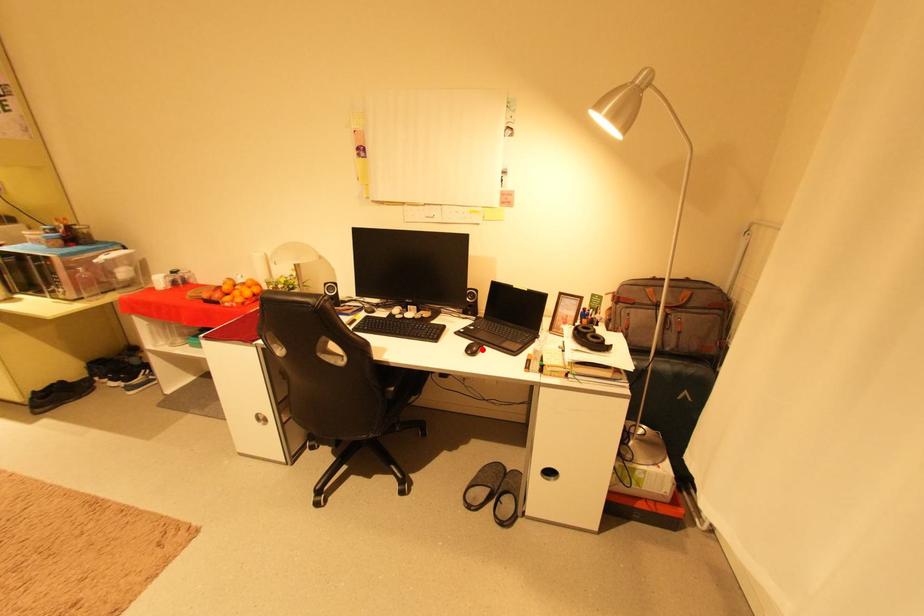
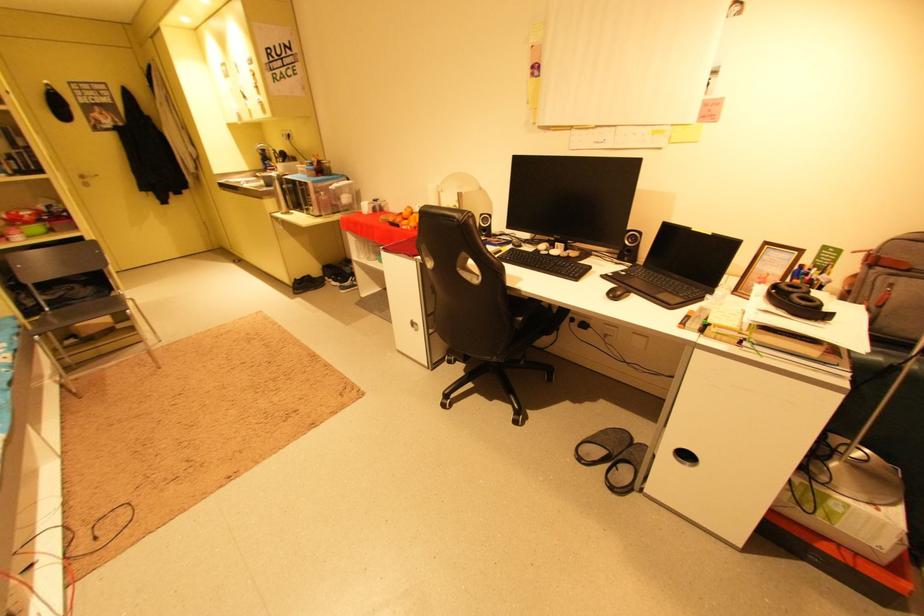
The point at the highlighted location is marked in the first image. Where is the corresponding point in the second image?

(627, 294)